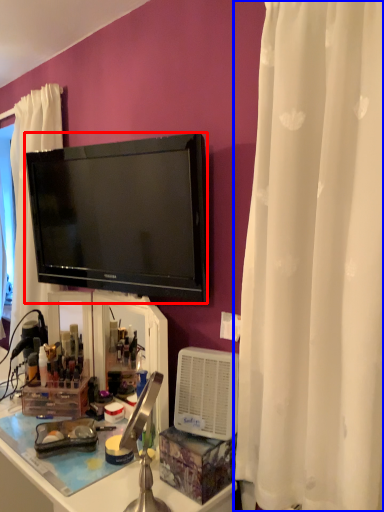
Question: Which object appears farthest to the camera in this image, television (highlighted by a red box) or curtain (highlighted by a blue box)?

Choices:
 (A) television
 (B) curtain

Answer: (A)